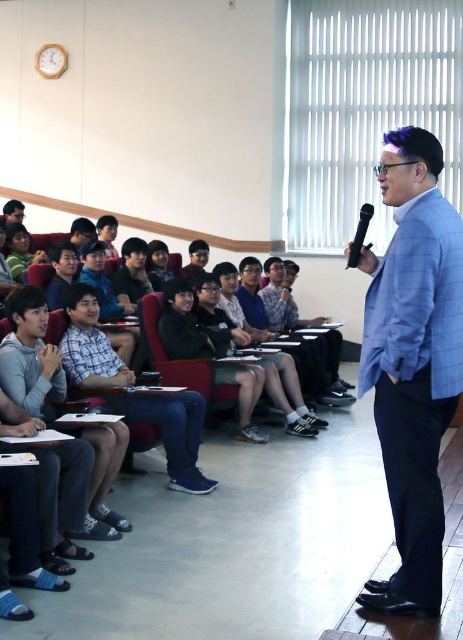
Question: Based on their relative distances, which object is farther from the blue plaid blazer at center?

Choices:
 (A) black plastic microphone at center
 (B) blue fabric jacket at upper right

Answer: (B)

Question: Which point appears farthest from the camera in this image?

Choices:
 (A) (421, 461)
 (B) (185, 465)

Answer: (B)

Question: Can you confirm if blue plaid blazer at center is positioned below black plastic microphone at center?

Choices:
 (A) yes
 (B) no

Answer: (A)

Question: Does blue casual shirt at center have a smaller size compared to black plastic microphone at center?

Choices:
 (A) yes
 (B) no

Answer: (B)

Question: Which object is the farthest from the blue plaid blazer at center?

Choices:
 (A) blue casual shirt at center
 (B) black plastic microphone at center
 (C) blue fabric jacket at upper right

Answer: (C)

Question: Is blue fabric jacket at upper right in front of black plastic microphone at center?

Choices:
 (A) yes
 (B) no

Answer: (B)